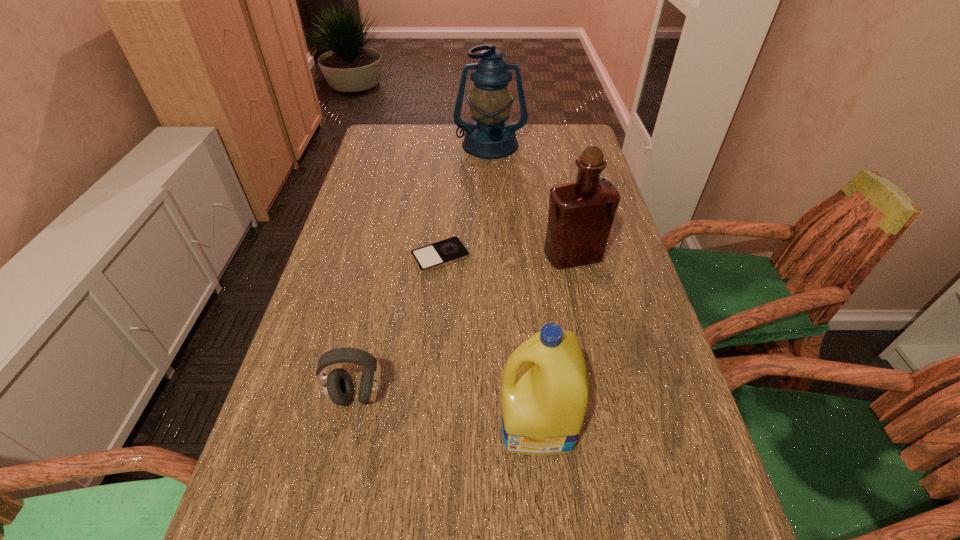
In order to click on free spot located 0.080m on the label of the detergent in this screenshot , I will do `click(457, 422)`.

At what (x,y) coordinates should I click in order to perform the action: click on vacant space located 0.110m on the ear cups of the headset. Please return your answer as a coordinate pair (x, y). The height and width of the screenshot is (540, 960). Looking at the image, I should click on (340, 472).

Identify the location of vacant space located 0.090m on the back of the iPod. The height and width of the screenshot is (540, 960). (444, 219).

The height and width of the screenshot is (540, 960). I want to click on object present at the far edge, so click(x=490, y=101).

Find the location of `object at the left edge`. object at the left edge is located at coordinates (338, 388).

Where is `object present at the right edge`? Image resolution: width=960 pixels, height=540 pixels. object present at the right edge is located at coordinates (581, 214).

Find the location of a particular element. free space at the left edge of the desktop is located at coordinates (385, 210).

The image size is (960, 540). Identify the location of free space at the right edge of the desktop. (633, 386).

This screenshot has width=960, height=540. Identify the location of vacant space at the far left corner of the desktop. (396, 132).

Identify the location of free space at the far right corner of the desktop. (563, 149).